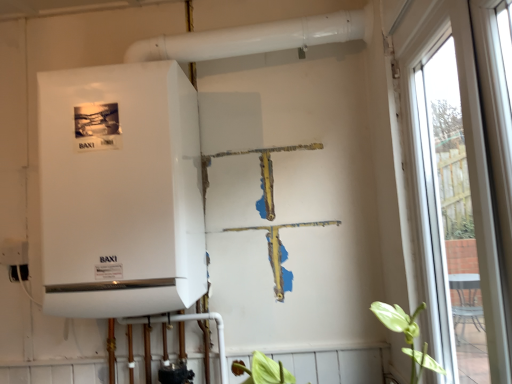
Question: Is white glossy boiler at left smaller than transparent glass window at right?

Choices:
 (A) yes
 (B) no

Answer: (B)

Question: Does white glossy boiler at left have a lesser width compared to transparent glass window at right?

Choices:
 (A) yes
 (B) no

Answer: (B)

Question: Is white glossy boiler at left outside transparent glass window at right?

Choices:
 (A) yes
 (B) no

Answer: (A)

Question: Considering the relative positions of white glossy boiler at left and transparent glass window at right in the image provided, is white glossy boiler at left to the right of transparent glass window at right from the viewer's perspective?

Choices:
 (A) no
 (B) yes

Answer: (A)

Question: Considering the relative sizes of white glossy boiler at left and transparent glass window at right in the image provided, is white glossy boiler at left bigger than transparent glass window at right?

Choices:
 (A) yes
 (B) no

Answer: (A)

Question: Does white glossy boiler at left lie behind transparent glass window at right?

Choices:
 (A) no
 (B) yes

Answer: (B)

Question: Can you confirm if transparent glass window at right is smaller than white glossy boiler at left?

Choices:
 (A) no
 (B) yes

Answer: (B)

Question: Is transparent glass window at right thinner than white glossy boiler at left?

Choices:
 (A) yes
 (B) no

Answer: (A)

Question: Can you confirm if transparent glass window at right is wider than white glossy boiler at left?

Choices:
 (A) yes
 (B) no

Answer: (B)

Question: From a real-world perspective, is transparent glass window at right beneath white glossy boiler at left?

Choices:
 (A) yes
 (B) no

Answer: (A)

Question: Would you say transparent glass window at right is a long distance from white glossy boiler at left?

Choices:
 (A) no
 (B) yes

Answer: (A)

Question: Considering the relative sizes of transparent glass window at right and white glossy boiler at left in the image provided, is transparent glass window at right taller than white glossy boiler at left?

Choices:
 (A) no
 (B) yes

Answer: (B)

Question: Which is correct: transparent glass window at right is inside white glossy boiler at left, or outside of it?

Choices:
 (A) inside
 (B) outside

Answer: (B)